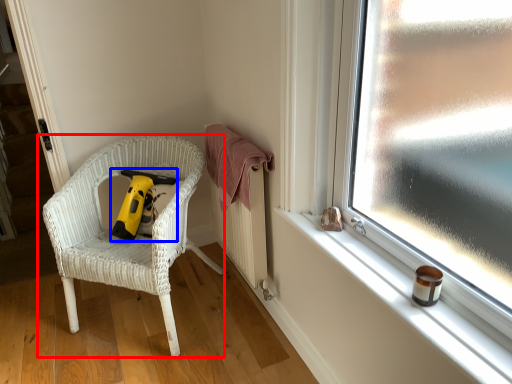
Question: Which object is closer to the camera taking this photo, chair (highlighted by a red box) or vacuum (highlighted by a blue box)?

Choices:
 (A) chair
 (B) vacuum

Answer: (A)